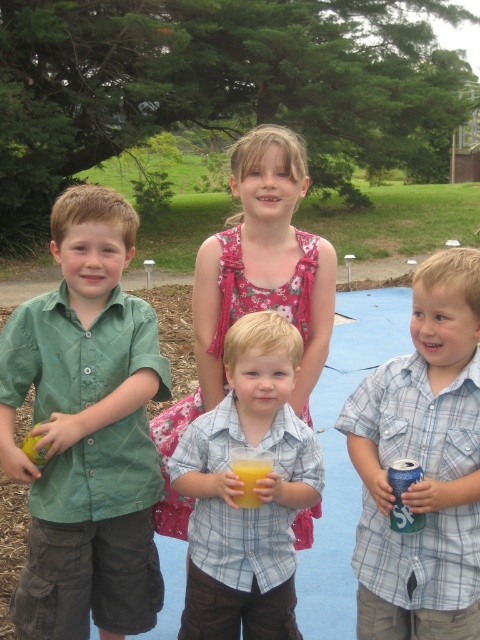
Is light blue plaid shirt at center closer to camera compared to translucent yellow liquid at center?

No, light blue plaid shirt at center is behind translucent yellow liquid at center.

Between light blue plaid shirt at center and translucent yellow liquid at center, which one has less height?

translucent yellow liquid at center

Is point (276, 552) in front of point (254, 465)?

No, it is not.

At what (x,y) coordinates should I click in order to perform the action: click on light blue plaid shirt at center. Please return your answer as a coordinate pair (x, y). The width and height of the screenshot is (480, 640). Looking at the image, I should click on (241, 490).

Who is positioned more to the right, translucent yellow liquid at center or yellow matte apple at left?

translucent yellow liquid at center is more to the right.

Between point (247, 502) and point (23, 440), which one is positioned behind?

Positioned behind is point (23, 440).

Who is more forward, [236,502] or [46,458]?

Point [236,502] is more forward.

Where is `translucent yellow liquid at center`? translucent yellow liquid at center is located at coordinates (250, 480).

What do you see at coordinates (422, 465) in the screenshot? The height and width of the screenshot is (640, 480). I see `blue plaid shirt at center` at bounding box center [422, 465].

Who is positioned more to the left, blue plaid shirt at center or blue metallic can at lower right?

Positioned to the left is blue metallic can at lower right.

This screenshot has width=480, height=640. I want to click on blue plaid shirt at center, so click(x=422, y=465).